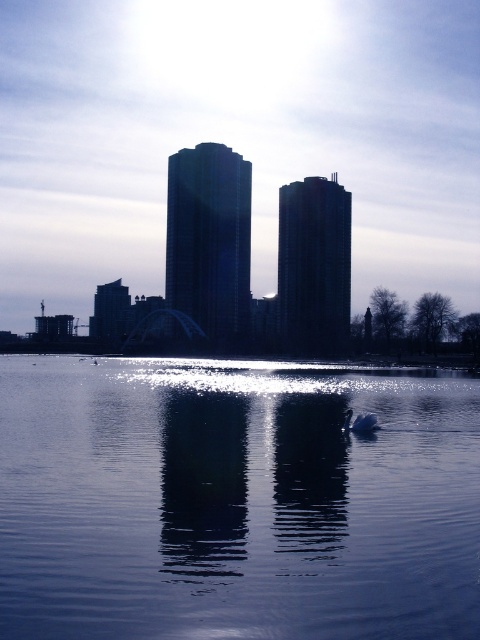
You are a photographer planning to take a wide shot of the waterfront scene. You want to ensure both the clear water at center and the white glossy swan at lower center are clearly visible in the frame. Given their sizes, which object will occupy more space in your photo?

The clear water at center is bigger than the white glossy swan at lower center, so it will occupy more space in the photo.

You are standing at the edge of the waterfront and see the clear water at center and the white glossy swan at lower center. Which object is closer to you?

The clear water at center is closer to the viewer than the white glossy swan at lower center.

You are standing at the waterfront and want to reach a specific point marked as point (200, 477). Given that the distance between you and this point is 19.41 meters, would you consider this a short walk or a long walk?

The distance between you and point (200, 477) is 19.41 meters. Since an average walking pace covers about 1.4 meters per second, it would take roughly 14 seconds to reach the point. This is considered a short walk.